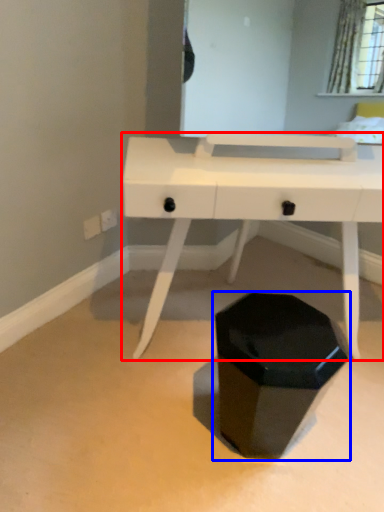
Question: Which point is closer to the camera, desk (highlighted by a red box) or waste container (highlighted by a blue box)?

Choices:
 (A) desk
 (B) waste container

Answer: (B)